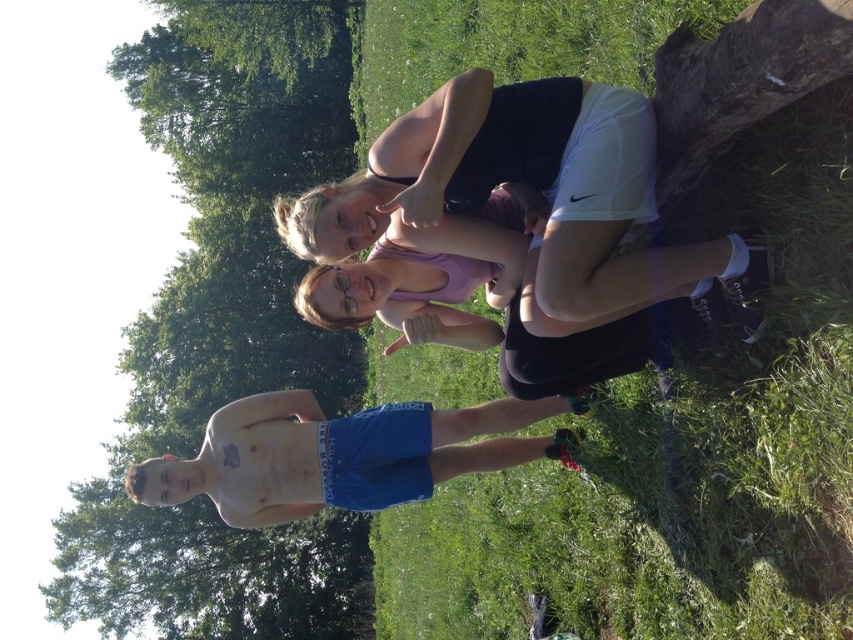
Question: Observing the image, what is the correct spatial positioning of green leafy tree at upper center in reference to pink fabric at center?

Choices:
 (A) right
 (B) left

Answer: (B)

Question: Which of the following is the closest to the observer?

Choices:
 (A) blue cotton shorts at lower left
 (B) pink fabric at center
 (C) green leafy tree at upper center

Answer: (B)

Question: Does green grass at upper right have a larger size compared to blue cotton shorts at lower left?

Choices:
 (A) yes
 (B) no

Answer: (A)

Question: Which point is closer to the camera?

Choices:
 (A) blue cotton shorts at lower left
 (B) green leafy tree at upper center
 (C) pink fabric at center
 (D) green grass at upper right

Answer: (D)

Question: Estimate the real-world distances between objects in this image. Which object is closer to the green leafy tree at upper center?

Choices:
 (A) pink fabric at center
 (B) matte black tank top at upper center
 (C) green grass at upper right

Answer: (C)

Question: Is matte black tank top at upper center to the right of pink fabric at center from the viewer's perspective?

Choices:
 (A) yes
 (B) no

Answer: (A)